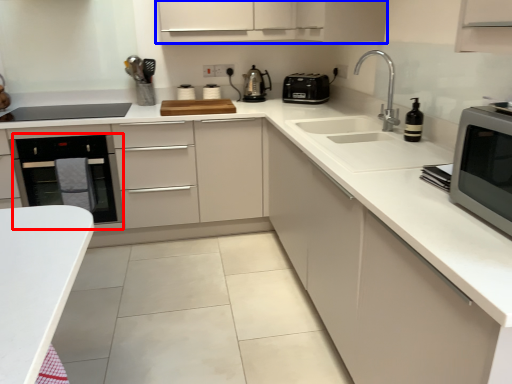
Question: Among these objects, which one is farthest to the camera, oven (highlighted by a red box) or cabinetry (highlighted by a blue box)?

Choices:
 (A) oven
 (B) cabinetry

Answer: (B)